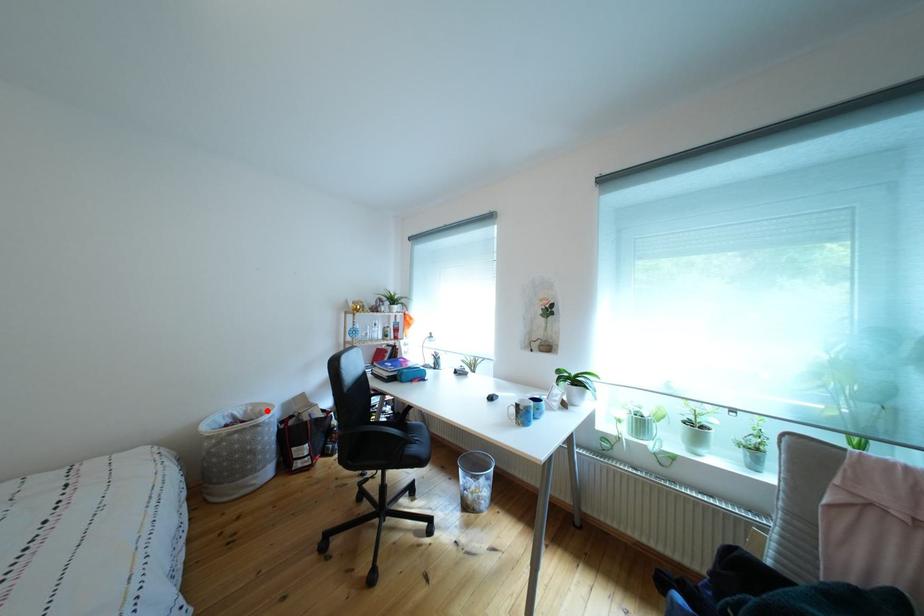
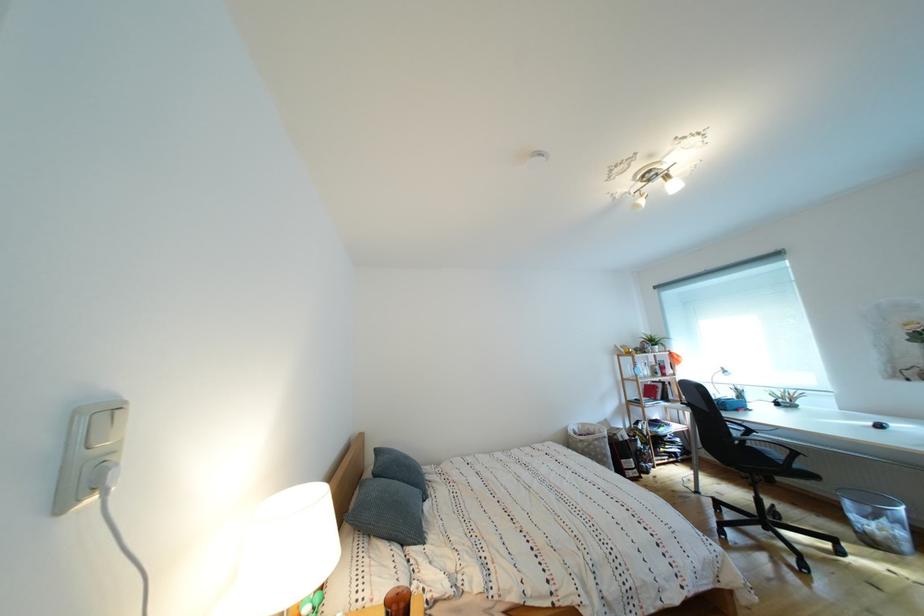
Where in the second image is the point corresponding to the highlighted location from the first image?

(594, 430)